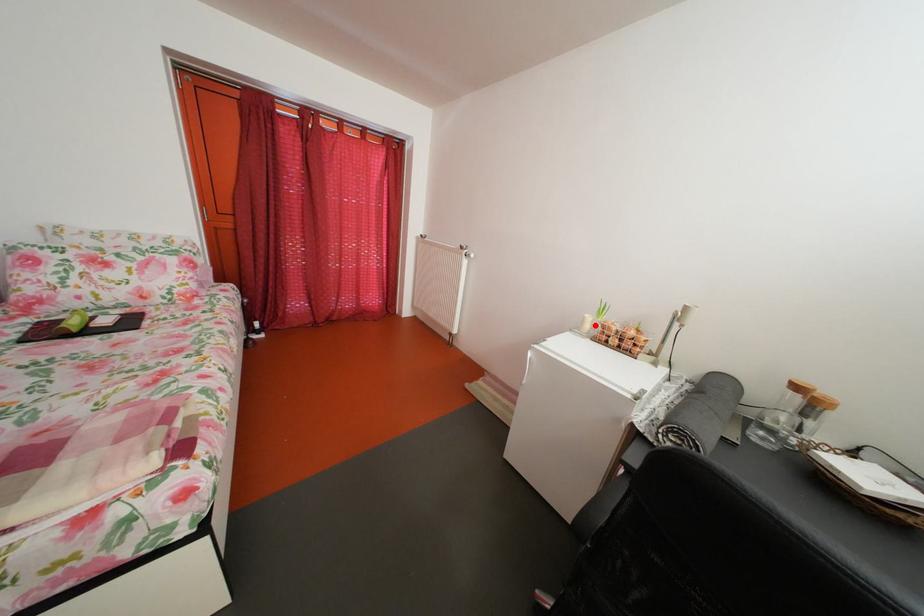
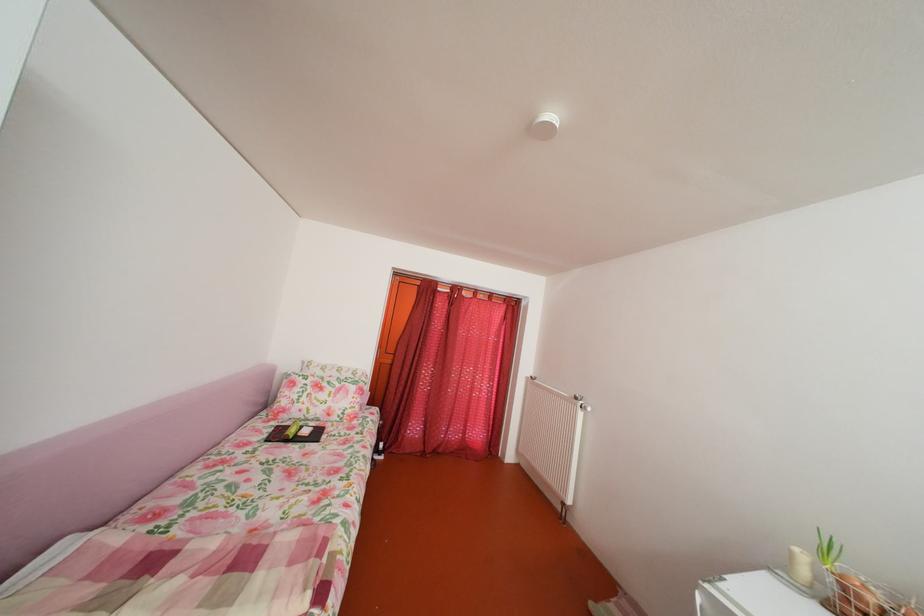
Locate, in the second image, the point that corresponds to the highlighted location in the first image.

(803, 561)